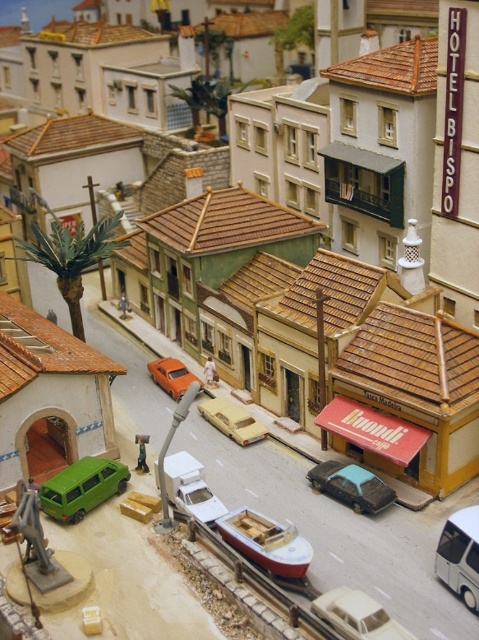
Can you confirm if white matte sedan at center is thinner than orange matte car at center?

Incorrect, white matte sedan at center's width is not less than orange matte car at center's.

Looking at this image, measure the distance between point (386, 632) and camera.

27.07 meters

What do you see at coordinates (356, 616) in the screenshot? The height and width of the screenshot is (640, 479). I see `white matte sedan at center` at bounding box center [356, 616].

This screenshot has width=479, height=640. What are the coordinates of `white matte sedan at center` in the screenshot? It's located at (356, 616).

Based on the photo, does metallic silver van at center have a greater width compared to orange matte car at center?

In fact, metallic silver van at center might be narrower than orange matte car at center.

Who is positioned more to the left, metallic silver van at center or orange matte car at center?

orange matte car at center

The width and height of the screenshot is (479, 640). Identify the location of metallic silver van at center. (459, 556).

Does metallic silver van at center appear on the left side of matte black car at center?

Incorrect, metallic silver van at center is not on the left side of matte black car at center.

Consider the image. Does metallic silver van at center have a greater height compared to matte black car at center?

Indeed, metallic silver van at center has a greater height compared to matte black car at center.

Which is behind, point (438, 557) or point (379, 499)?

Positioned behind is point (379, 499).

Image resolution: width=479 pixels, height=640 pixels. Identify the location of metallic silver van at center. (459, 556).